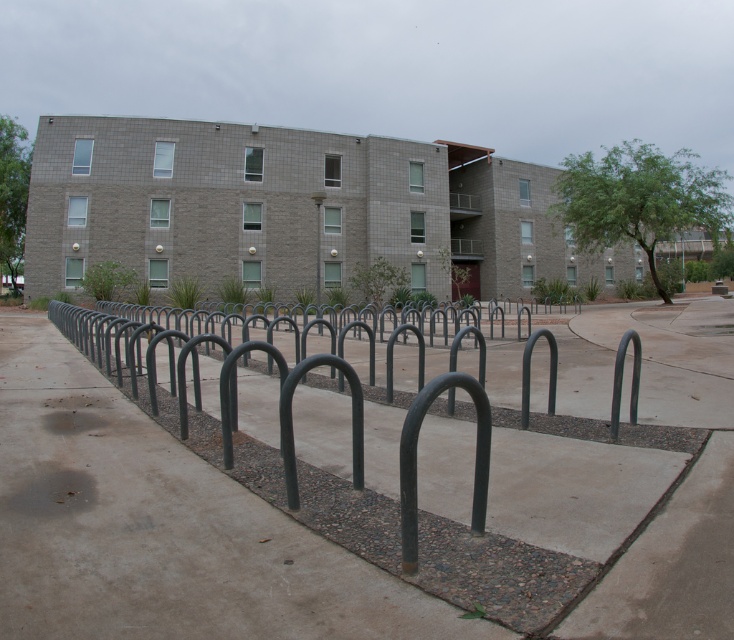
You are a delivery person who needs to park your bike near the gray concrete pavement at center and the metallic pole at center. The bike requires 10 feet of space to park. Is there enough space between them?

The gray concrete pavement at center and metallic pole at center are 48.60 feet apart from each other, so yes, there is enough space between them to park the bike requiring 10 feet of space.

You are standing in front of the building and want to place a 3.0 meter long banner on the gray concrete pavement at center. Can you fit the banner along its length?

The gray concrete pavement at center is 2.50 meters away from viewer, so the banner is longer than the available space. It won

Consider the image. You are standing at the red door of the building and want to go to the bike rack area. Which point, point (374, 573) or point (316, 198), is closer to you?

Point (374, 573) is in front of point (316, 198), so it is closer to you.